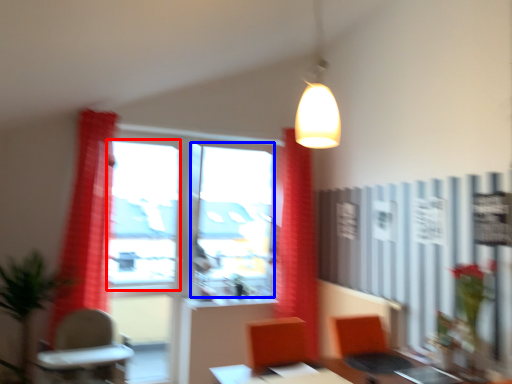
Question: Which point is further to the camera, window screen (highlighted by a red box) or window screen (highlighted by a blue box)?

Choices:
 (A) window screen
 (B) window screen

Answer: (B)